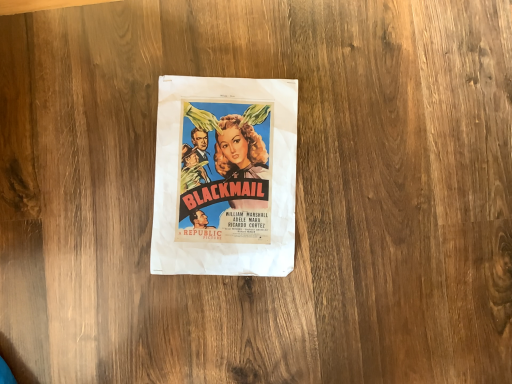
What do you see at coordinates (225, 176) in the screenshot? I see `matte paper poster at center` at bounding box center [225, 176].

Find the location of a particular element. This screenshot has width=512, height=384. matte paper poster at center is located at coordinates (225, 176).

Identify the location of matte paper poster at center. The width and height of the screenshot is (512, 384). (225, 176).